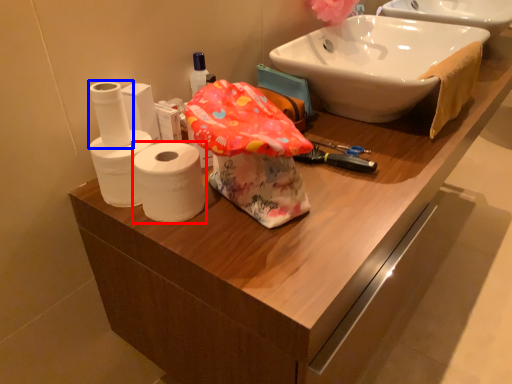
Question: Among these objects, which one is nearest to the camera, toilet paper (highlighted by a red box) or toilet paper (highlighted by a blue box)?

Choices:
 (A) toilet paper
 (B) toilet paper

Answer: (A)